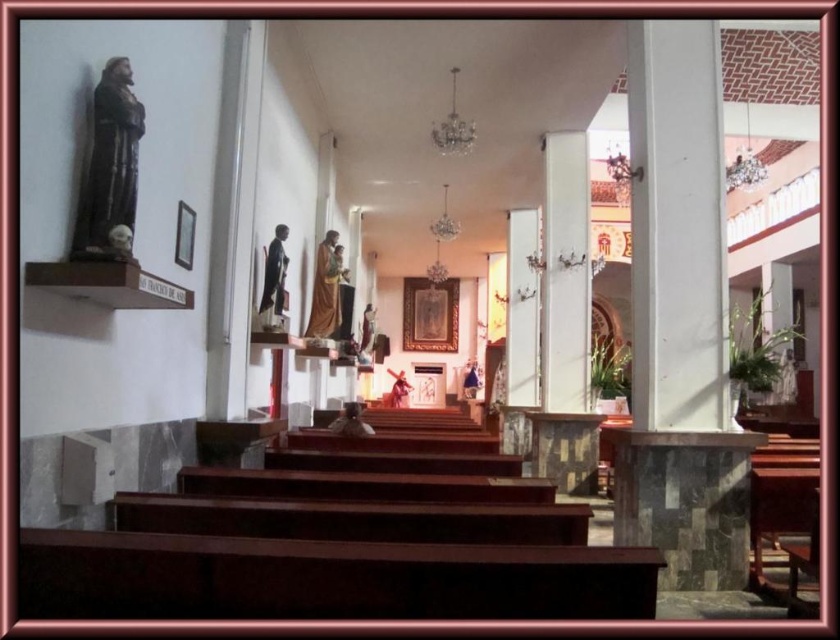
Question: Is white marble pillar at right positioned in front of matte black statue at center?

Choices:
 (A) no
 (B) yes

Answer: (B)

Question: Which object is positioned closest to the white marble pillar at right?

Choices:
 (A) matte black statue at center
 (B) wooden statue at center

Answer: (A)

Question: Which of the following is the farthest from the observer?

Choices:
 (A) matte brown statue at left
 (B) matte black statue at center

Answer: (B)

Question: Which point is closer to the camera?

Choices:
 (A) wooden statue at center
 (B) white marble pillar at right
 (C) matte black statue at center
 (D) matte brown statue at left

Answer: (D)

Question: Does matte brown statue at left have a greater width compared to matte black statue at center?

Choices:
 (A) yes
 (B) no

Answer: (A)

Question: Is wooden statue at center to the left of matte black statue at center from the viewer's perspective?

Choices:
 (A) no
 (B) yes

Answer: (A)